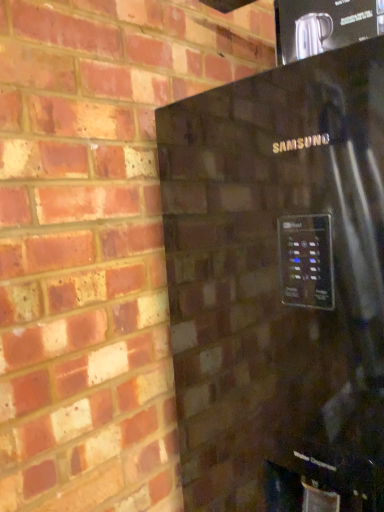
Identify the location of black glossy refrigerator at upper right. (279, 285).

Describe the element at coordinates (279, 285) in the screenshot. Image resolution: width=384 pixels, height=512 pixels. I see `black glossy refrigerator at upper right` at that location.

Identify the location of black glossy refrigerator at upper right. (279, 285).